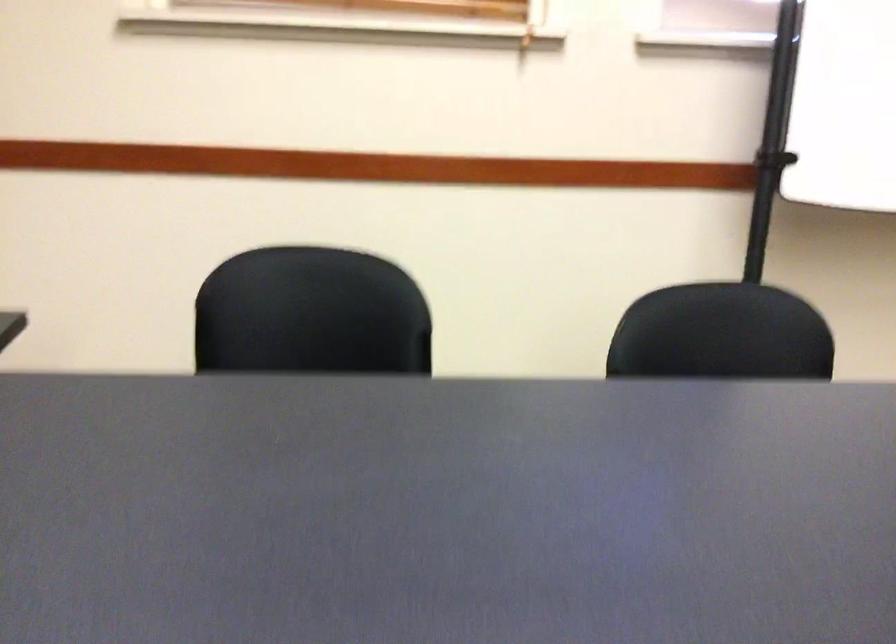
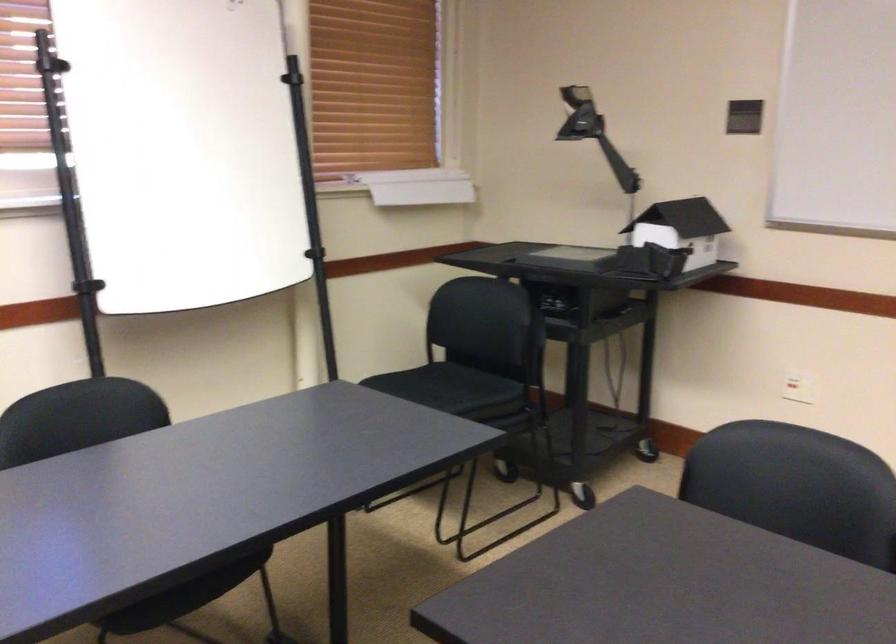
Find the pixel in the second image that matches (x=767, y=156) in the first image.

(88, 285)